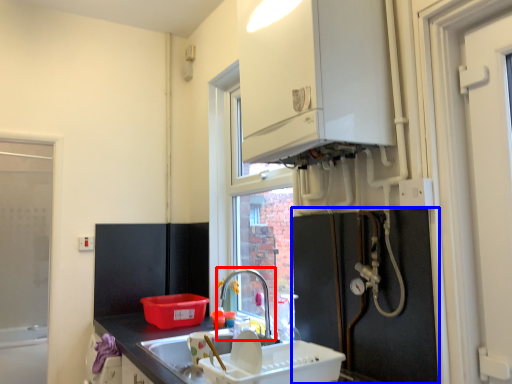
Question: Which object is further to the camera taking this photo, tap (highlighted by a red box) or appliance (highlighted by a blue box)?

Choices:
 (A) tap
 (B) appliance

Answer: (A)